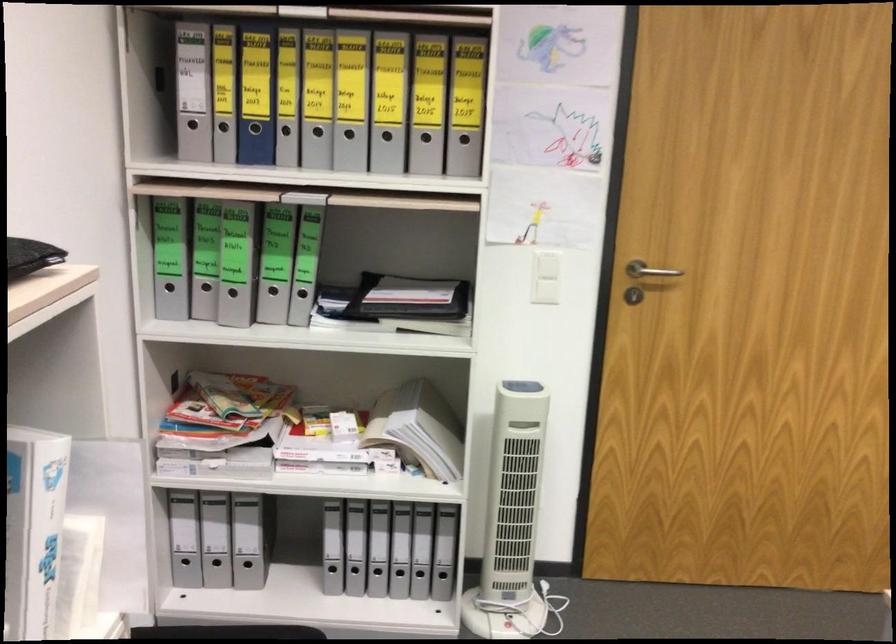
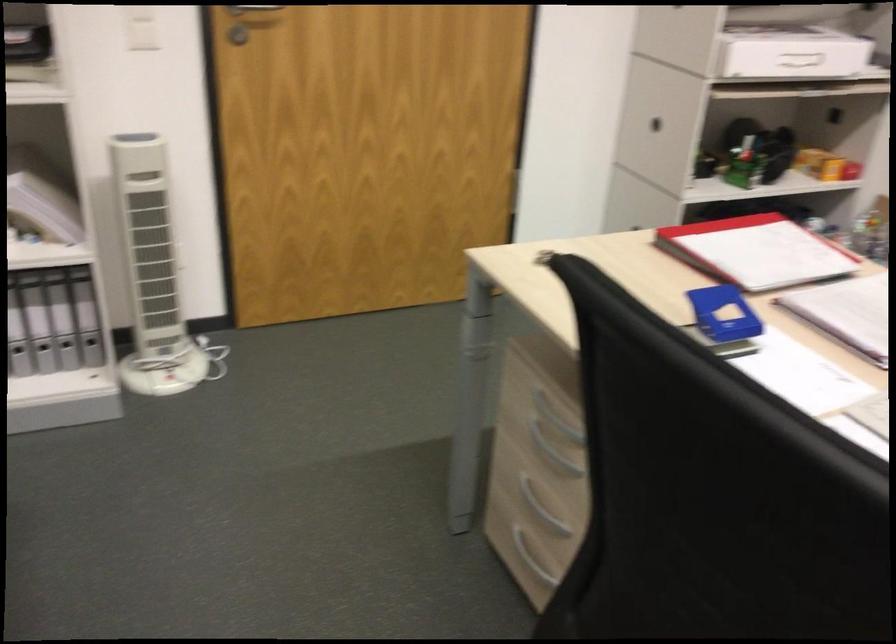
In the second image, find the point that corresponds to point (443, 574) in the first image.

(91, 339)